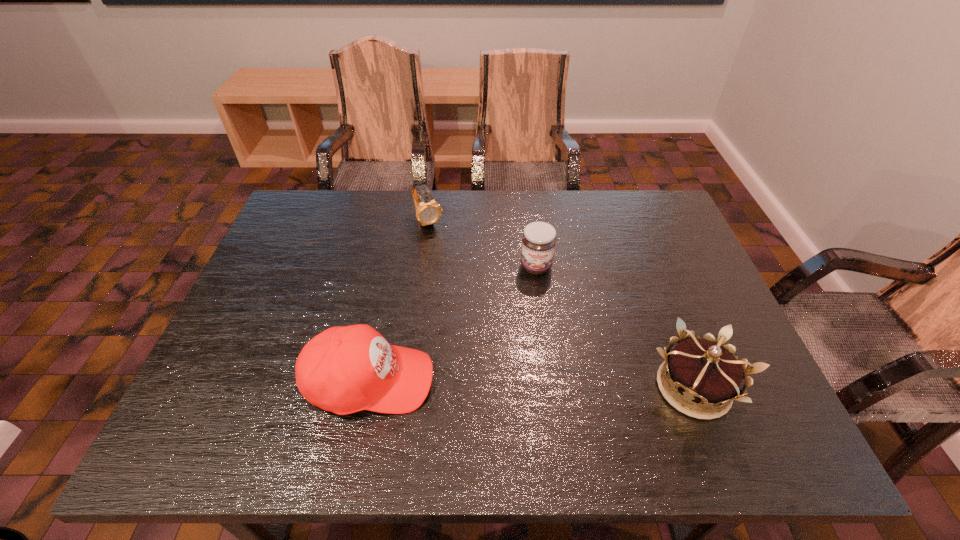
Where is `free space located 0.160m on the face of the farthest object`? This screenshot has width=960, height=540. free space located 0.160m on the face of the farthest object is located at coordinates (452, 268).

At what (x,y) coordinates should I click in order to perform the action: click on vacant region located on the face of the farthest object. Please return your answer as a coordinate pair (x, y). The height and width of the screenshot is (540, 960). Looking at the image, I should click on (462, 284).

Find the location of a particular element. vacant area situated on the face of the farthest object is located at coordinates (451, 265).

The width and height of the screenshot is (960, 540). Identify the location of object that is at the far edge. (428, 212).

Find the location of a particular element. The image size is (960, 540). baseball cap that is at the near edge is located at coordinates (346, 369).

Where is `crown present at the near edge`? crown present at the near edge is located at coordinates (704, 371).

This screenshot has width=960, height=540. Find the location of `object situated at the right edge`. object situated at the right edge is located at coordinates (704, 371).

Locate an element on the screen. object that is at the near right corner is located at coordinates (704, 371).

This screenshot has height=540, width=960. I want to click on vacant space at the far edge, so click(603, 230).

At what (x,y) coordinates should I click in order to perform the action: click on vacant space at the near edge of the desktop. Please return your answer as a coordinate pair (x, y). Looking at the image, I should click on (646, 392).